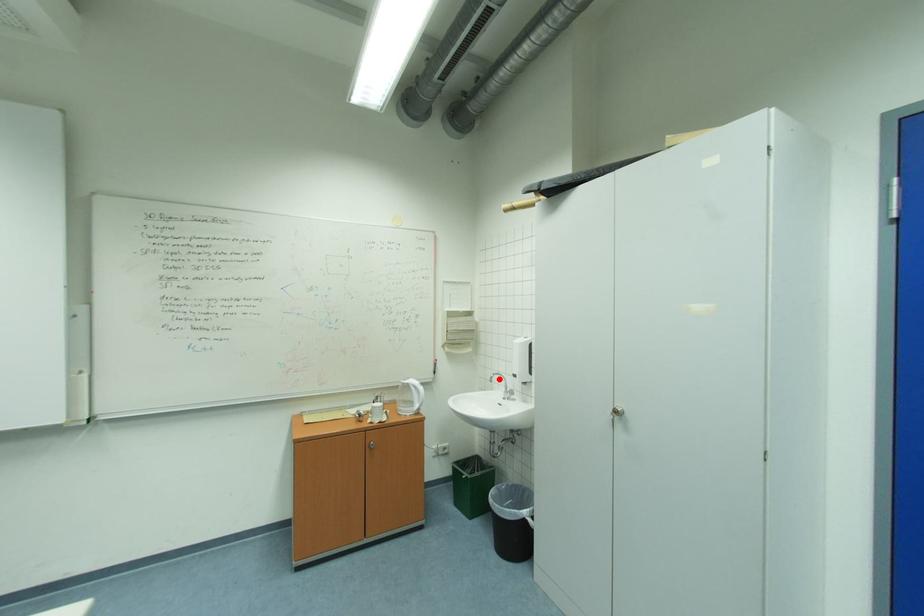
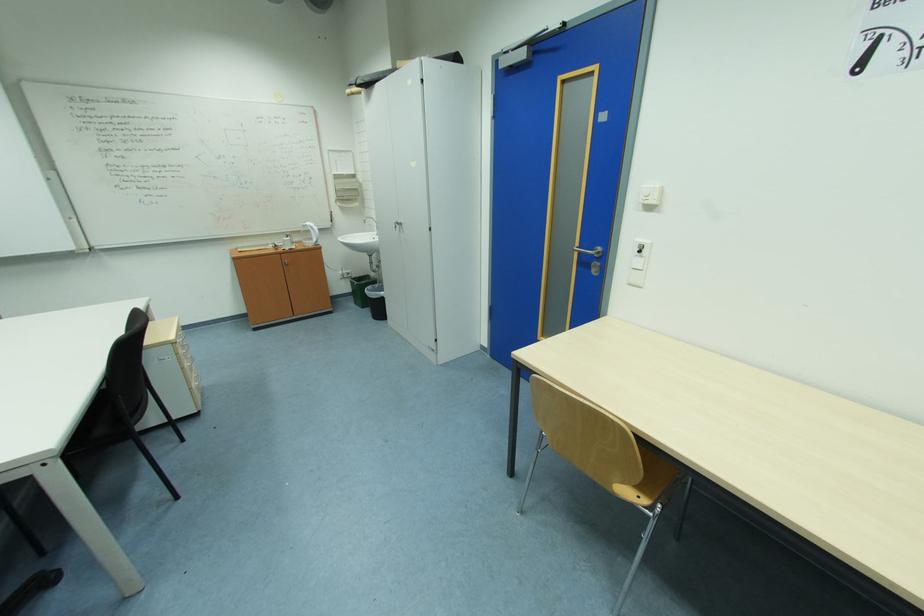
Locate, in the second image, the point that corresponds to the highlighted location in the first image.

(371, 222)